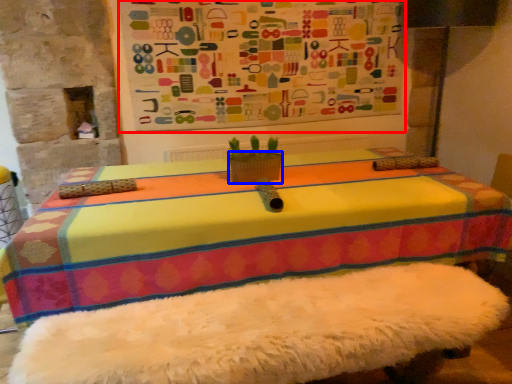
Question: Which object appears farthest to the camera in this image, bulletin board (highlighted by a red box) or flowerpot (highlighted by a blue box)?

Choices:
 (A) bulletin board
 (B) flowerpot

Answer: (A)